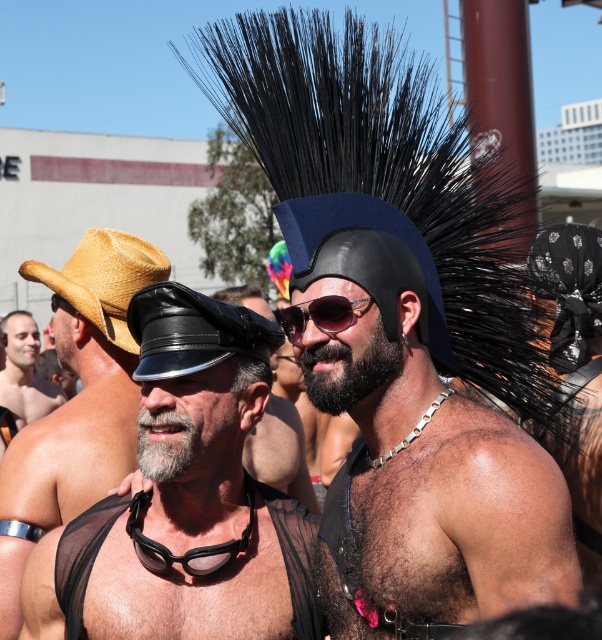
You are a photographer at the event and want to capture both the black leather hat at upper center and the strawhat at left in a single frame. Which hat should you position closer to the camera to ensure both are clearly visible?

To ensure both the black leather hat at upper center and the strawhat at left are clearly visible, position the larger black leather hat at upper center closer to the camera since it is bigger and requires more focus, while the smaller strawhat at left can be slightly farther back but still in frame.

You are a photographer at the event and want to capture a clear shot of both the black mesh vest at center and the sunglassestransparent at center. Since the vest is below the sunglasses, where should you position the focus point to ensure both are in sharp focus?

The black mesh vest at center is located below the sunglassestransparent at center. To ensure both are in sharp focus, position the focus point at the midpoint between them, which would be around the sunglassestransparent at center since it is higher up.

You are a photographer at the event and want to capture a photo of both the matte black hat at left and the black leather cap at center in the same frame. Given that your camera has a focal length of 50mm and a sensor size of 24mm x 36mm, what is the minimum distance you need to stand from the nearest object to ensure both are in frame?

The minimum distance required is approximately 1.5 meters. This is calculated using the formula for depth of field and the given focal length and sensor size, ensuring both the matte black hat at left and the black leather cap at center are within the frame considering their separation of 29.97 inches.